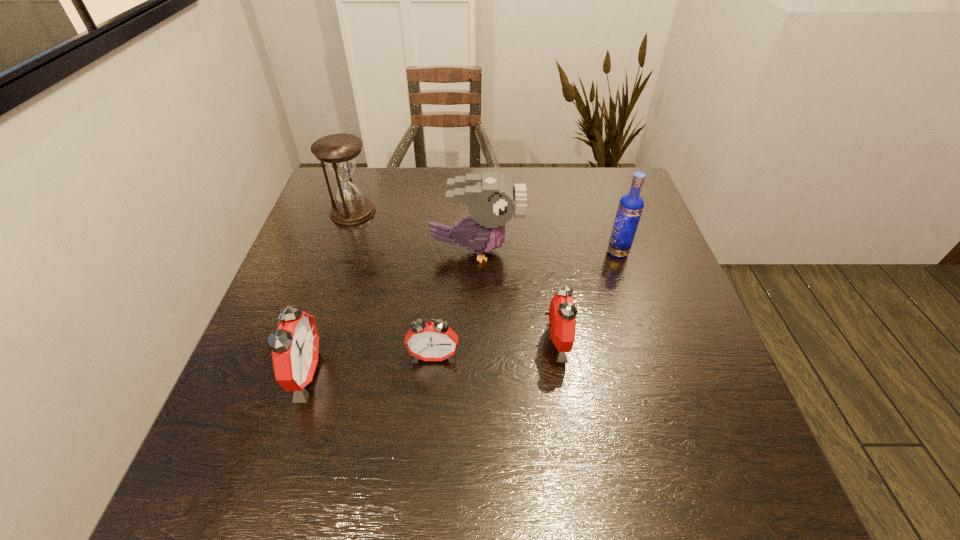
Please point a vacant point for placing a alarm clock on the right. Please provide its 2D coordinates. Your answer should be formatted as a tuple, i.e. [(x, y)], where the tuple contains the x and y coordinates of a point satisfying the conditions above.

[(670, 326)]